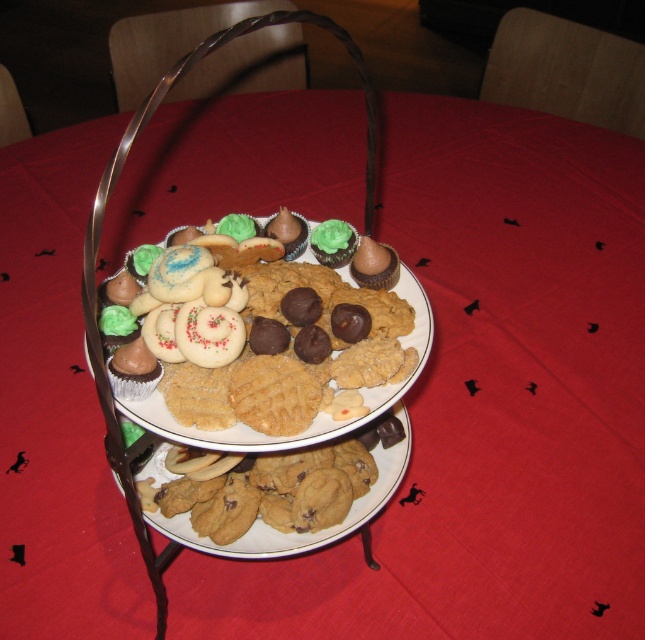
Question: From the image, what is the correct spatial relationship of matte chocolate cookie at center in relation to metallic silver basket at center?

Choices:
 (A) below
 (B) above

Answer: (A)

Question: Is matte chocolate cookie at center smaller than metallic silver basket at center?

Choices:
 (A) no
 (B) yes

Answer: (B)

Question: Which object appears closest to the camera in this image?

Choices:
 (A) metallic silver basket at center
 (B) matte chocolate cookie at center

Answer: (A)

Question: From the image, what is the correct spatial relationship of matte chocolate cookie at center in relation to metallic silver basket at center?

Choices:
 (A) left
 (B) right

Answer: (A)